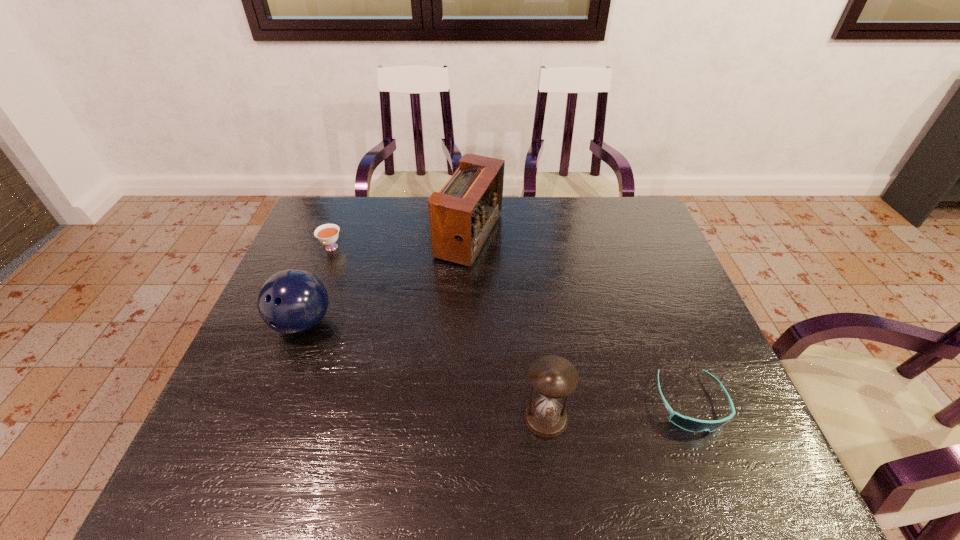
What are the coordinates of `vacant area that lies between the sunglasses and the second shortest object` in the screenshot? It's located at (511, 326).

Locate an element on the screen. object that stands as the fourth closest to the rightmost object is located at coordinates (327, 234).

You are a GUI agent. You are given a task and a screenshot of the screen. Output one action in this format:
    pyautogui.click(x=<x>, y=<y>)
    Task: Click on the object that is the third closest to the shortest object
    The height and width of the screenshot is (540, 960).
    Given the screenshot: What is the action you would take?
    pyautogui.click(x=292, y=301)

I want to click on free spot that satisfies the following two spatial constraints: 1. on the surface of the third nearest object near the finger holes; 2. on the left side of the hourglass, so click(266, 418).

Image resolution: width=960 pixels, height=540 pixels. What are the coordinates of `free space that satisfies the following two spatial constraints: 1. on the side of the fourth tallest object with the handle; 2. on the left side of the hourglass` in the screenshot? It's located at (265, 418).